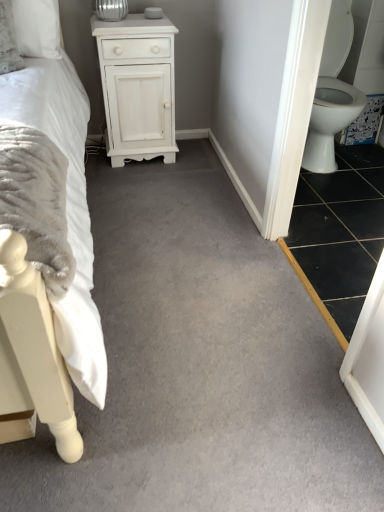
This screenshot has height=512, width=384. In order to click on free location in front of white glossy toilet at right in this screenshot , I will do `click(344, 196)`.